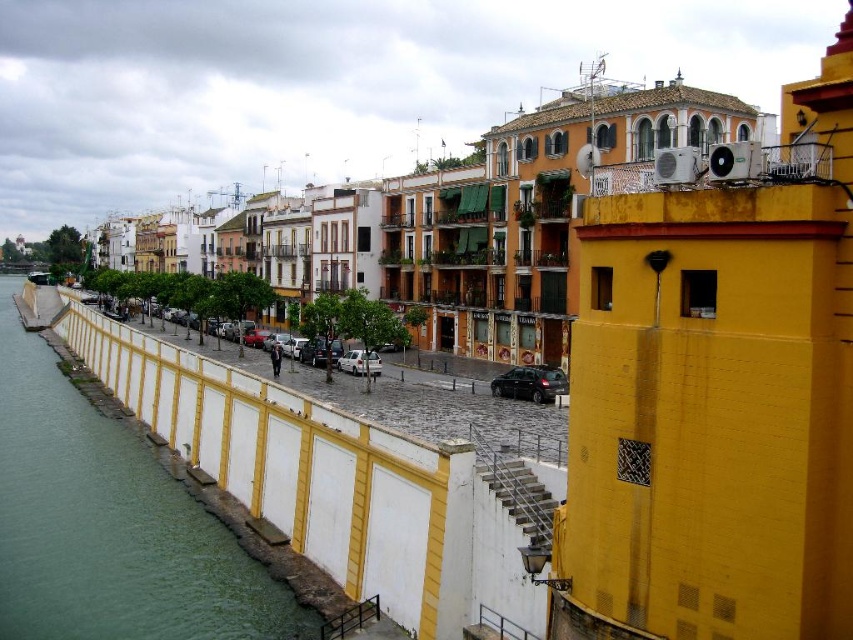
You are a tourist standing on the cobblestone street and want to take a photo of the green concrete wall at lower left and the shiny black car at center. Which object should you frame first in your camera to ensure both are in the shot?

You should frame the green concrete wall at lower left first since it is to the left of the shiny black car at center, allowing both to be captured in the photo.

You are a delivery drone flying over the riverside scene. You need to deliver a package to the silver metallic car at center, which is parked near the green concrete wall at lower left. The drone has a maximum delivery range of 30 meters. Can you successfully deliver the package?

The green concrete wall at lower left and silver metallic car at center are 27.92 meters apart. Since the drone has a maximum delivery range of 30 meters, it can successfully deliver the package as the distance is within the range.

Consider the image. You are a tourist standing at the riverside and want to take a photo of the shiny black car at center without including the green concrete wall at lower left in the frame. Is this possible given their positions?

The green concrete wall at lower left is positioned under the shiny black car at center, so taking a photo of the shiny black car at center without including the green concrete wall at lower left would be difficult as the wall is directly beneath the car in the scene.